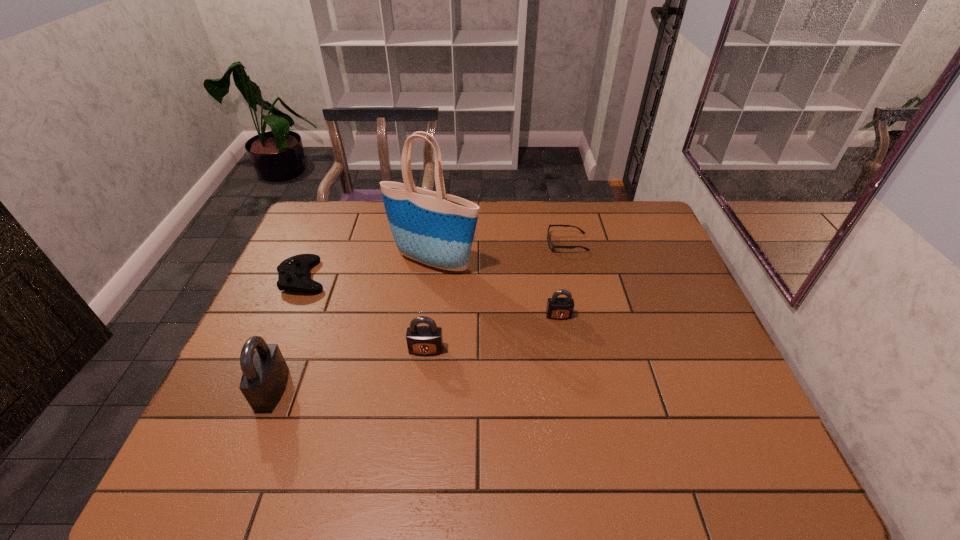
Where is `free space that satisfies the following two spatial constraints: 1. on the front of the second nearest object near the keyhole; 2. on the front of the second tallest object near the keyhole`? The image size is (960, 540). free space that satisfies the following two spatial constraints: 1. on the front of the second nearest object near the keyhole; 2. on the front of the second tallest object near the keyhole is located at coordinates (421, 389).

Where is `free spot that satisfies the following two spatial constraints: 1. on the front-facing side of the sunglasses; 2. on the front of the fourth tallest object near the keyhole`? free spot that satisfies the following two spatial constraints: 1. on the front-facing side of the sunglasses; 2. on the front of the fourth tallest object near the keyhole is located at coordinates (584, 315).

What are the coordinates of `vacant space that satisfies the following two spatial constraints: 1. on the front of the fourth tallest object near the keyhole; 2. on the front of the second tallest object near the keyhole` in the screenshot? It's located at (571, 389).

Locate an element on the screen. Image resolution: width=960 pixels, height=540 pixels. free space that satisfies the following two spatial constraints: 1. on the front-facing side of the shortest object; 2. on the front side of the second shortest object is located at coordinates (575, 277).

Locate an element on the screen. This screenshot has width=960, height=540. free region that satisfies the following two spatial constraints: 1. on the front-facing side of the shortest object; 2. on the front of the fourth shortest object near the keyhole is located at coordinates (591, 350).

Locate an element on the screen. vacant space that satisfies the following two spatial constraints: 1. on the front of the shortest padlock near the keyhole; 2. on the front of the tallest padlock near the keyhole is located at coordinates (571, 389).